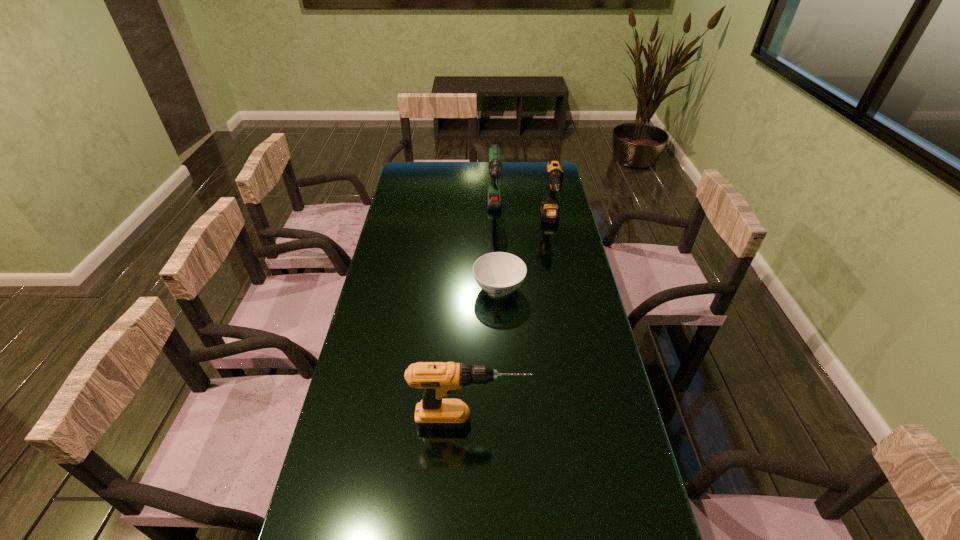
Where is `vacant space at the right edge of the desktop`? The height and width of the screenshot is (540, 960). vacant space at the right edge of the desktop is located at coordinates (601, 371).

In the image, there is a desktop. At what (x,y) coordinates should I click in order to perform the action: click on free space at the far left corner. Please return your answer as a coordinate pair (x, y). Looking at the image, I should click on (417, 173).

Where is `vacant region at the far right corner of the desktop`? The image size is (960, 540). vacant region at the far right corner of the desktop is located at coordinates (542, 166).

At what (x,y) coordinates should I click in order to perform the action: click on free space between the shortest object and the rightmost object. Please return your answer as a coordinate pair (x, y). This screenshot has height=540, width=960. Looking at the image, I should click on (524, 255).

The image size is (960, 540). I want to click on vacant area between the rightmost drill and the chinaware, so click(524, 255).

The image size is (960, 540). In order to click on vacant space in between the shortest object and the rightmost drill in this screenshot , I will do `click(524, 255)`.

Image resolution: width=960 pixels, height=540 pixels. I want to click on free space that is in between the second nearest object and the rightmost drill, so click(x=524, y=255).

Identify the location of free space between the rightmost object and the third farthest object. point(524,255).

Find the location of a particular element. This screenshot has width=960, height=540. vacant area between the nearest object and the shortest object is located at coordinates (485, 355).

Locate an element on the screen. This screenshot has width=960, height=540. blank region between the shortest object and the rightmost drill is located at coordinates (524, 255).